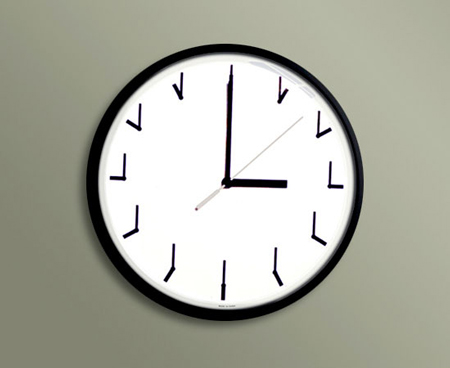
This screenshot has height=368, width=450. I want to click on empty space top of clock, so click(233, 18).